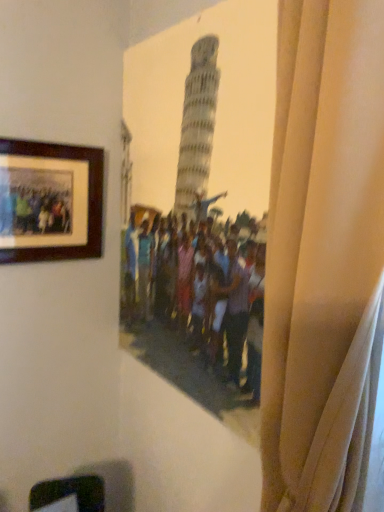
Question: Can you confirm if wooden picture frame at upper left is shorter than beige fabric curtain at right?

Choices:
 (A) yes
 (B) no

Answer: (A)

Question: From a real-world perspective, is wooden picture frame at upper left over beige fabric curtain at right?

Choices:
 (A) yes
 (B) no

Answer: (A)

Question: Is wooden picture frame at upper left at the right side of beige fabric curtain at right?

Choices:
 (A) yes
 (B) no

Answer: (B)

Question: From a real-world perspective, is wooden picture frame at upper left positioned under beige fabric curtain at right based on gravity?

Choices:
 (A) yes
 (B) no

Answer: (B)

Question: Can you confirm if wooden picture frame at upper left is wider than beige fabric curtain at right?

Choices:
 (A) yes
 (B) no

Answer: (B)

Question: Is there a large distance between wooden picture frame at upper left and beige fabric curtain at right?

Choices:
 (A) no
 (B) yes

Answer: (A)

Question: From the image's perspective, is beige fabric curtain at right below wooden picture frame at upper left?

Choices:
 (A) no
 (B) yes

Answer: (B)

Question: Does beige fabric curtain at right have a greater height compared to wooden picture frame at upper left?

Choices:
 (A) yes
 (B) no

Answer: (A)

Question: Is beige fabric curtain at right smaller than wooden picture frame at upper left?

Choices:
 (A) no
 (B) yes

Answer: (A)

Question: Could wooden picture frame at upper left be considered to be inside beige fabric curtain at right?

Choices:
 (A) no
 (B) yes

Answer: (A)

Question: Considering the relative positions of beige fabric curtain at right and wooden picture frame at upper left in the image provided, is beige fabric curtain at right to the right of wooden picture frame at upper left from the viewer's perspective?

Choices:
 (A) no
 (B) yes

Answer: (B)

Question: Can you confirm if beige fabric curtain at right is wider than wooden picture frame at upper left?

Choices:
 (A) no
 (B) yes

Answer: (B)

Question: From the image's perspective, is beige fabric curtain at right positioned above or below wooden picture frame at upper left?

Choices:
 (A) above
 (B) below

Answer: (B)